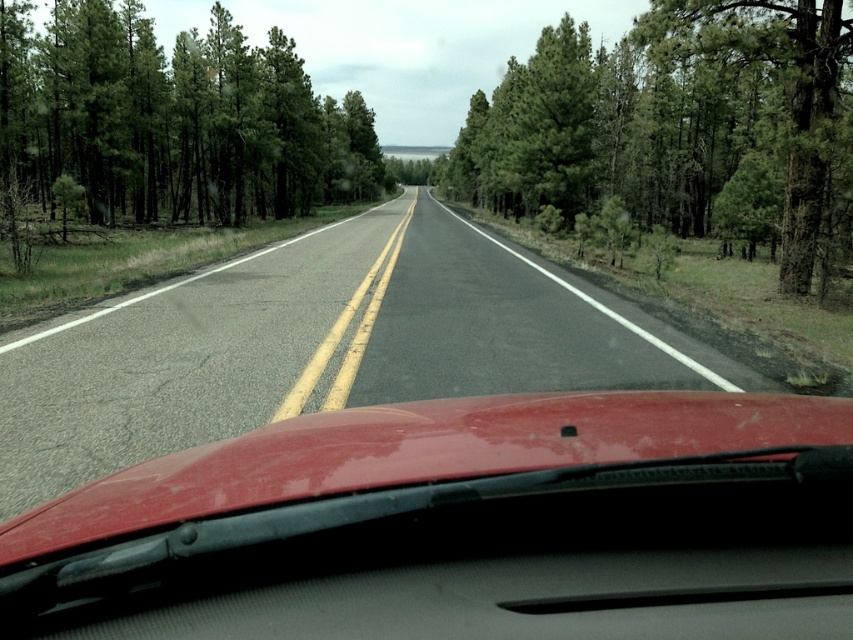
Does point (691, 540) come in front of point (741, 380)?

Yes, it is in front of point (741, 380).

Is glossy red car at center behind asphalt road at center?

No.

Locate an element on the screen. glossy red car at center is located at coordinates (462, 525).

The image size is (853, 640). I want to click on glossy red car at center, so click(x=462, y=525).

Can you confirm if asphalt road at center is shorter than green textured tree at center?

Yes.

Which is behind, point (216, 392) or point (827, 86)?

Positioned behind is point (827, 86).

Which is behind, point (625, 330) or point (660, 186)?

The point (660, 186) is more distant.

Locate an element on the screen. asphalt road at center is located at coordinates (321, 346).

In the scene shown: Can you confirm if green textured tree at center is shorter than green matte tree at left?

Indeed, green textured tree at center has a lesser height compared to green matte tree at left.

Who is shorter, green textured tree at center or green matte tree at left?

green textured tree at center

In the scene shown: Measure the distance between point (762, 109) and camera.

They are 116.06 feet apart.

The height and width of the screenshot is (640, 853). In order to click on green textured tree at center in this screenshot , I will do `click(669, 120)`.